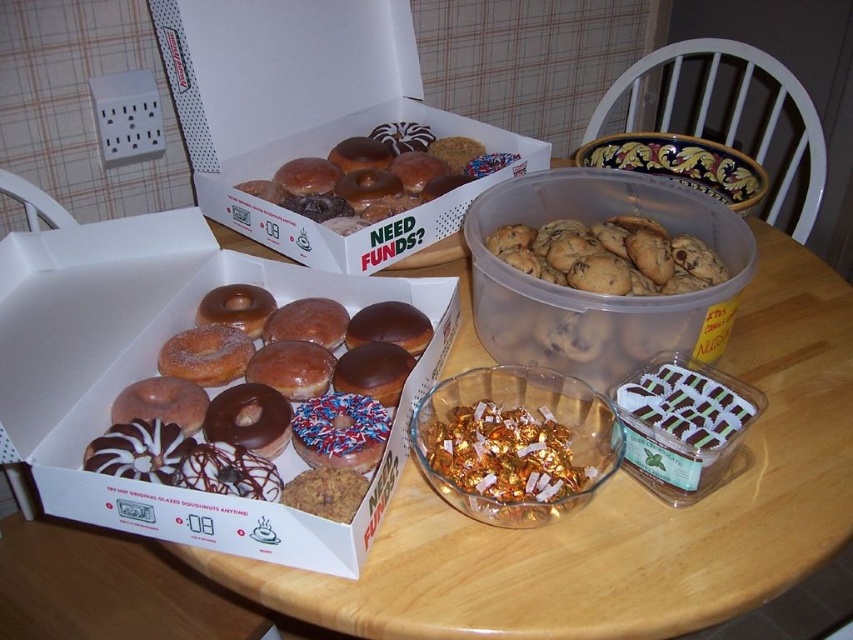
Question: Which point is closer to the camera?

Choices:
 (A) (294, 444)
 (B) (476, 464)

Answer: (B)

Question: Does glazed donut at center lie behind glazed chocolate donut at center?

Choices:
 (A) yes
 (B) no

Answer: (A)

Question: Where is white cardboard box of donuts at left located in relation to glazed chocolate donut at center in the image?

Choices:
 (A) above
 (B) below

Answer: (A)

Question: Which of the following is the farthest from the observer?

Choices:
 (A) (x=399, y=61)
 (B) (x=380, y=451)
 (C) (x=351, y=308)
 (D) (x=308, y=484)

Answer: (A)

Question: Based on their relative distances, which object is farther from the glazed chocolate donut at center?

Choices:
 (A) chocolate glazed donut at center
 (B) glazed donut at center

Answer: (B)

Question: Is glazed donuts at left to the left of chocolate chip cookies at center from the viewer's perspective?

Choices:
 (A) no
 (B) yes

Answer: (B)